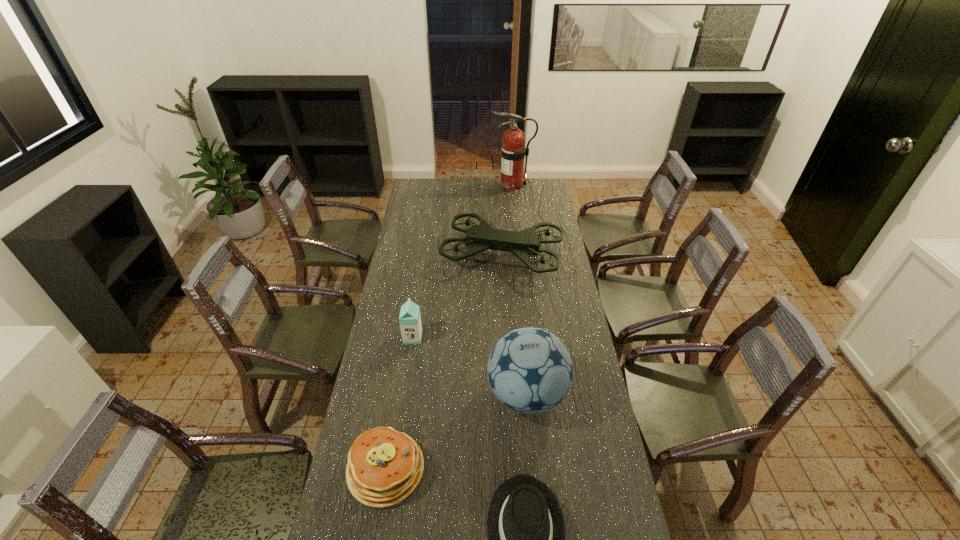
Image resolution: width=960 pixels, height=540 pixels. In order to click on drone located in the right edge section of the desktop in this screenshot , I will do `click(523, 244)`.

Where is `soccer ball situated at the right edge`? soccer ball situated at the right edge is located at coordinates (529, 370).

The image size is (960, 540). I want to click on object that is positioned at the far right corner, so click(x=513, y=151).

Find the location of a particular element. This screenshot has height=540, width=960. blank space at the left edge is located at coordinates (395, 271).

In the image, there is a desktop. Where is `vacant region at the right edge`? This screenshot has width=960, height=540. vacant region at the right edge is located at coordinates (551, 312).

Where is `blank area at the far left corner`? The image size is (960, 540). blank area at the far left corner is located at coordinates (419, 181).

Find the location of a particular element. This screenshot has width=960, height=540. vacant space at the far right corner of the desktop is located at coordinates (535, 184).

You are a GUI agent. You are given a task and a screenshot of the screen. Output one action in this format:
    pyautogui.click(x=<x>, y=<y>)
    Task: Click on the vacant space in between the third farthest object and the second farthest object
    This screenshot has width=960, height=540.
    Given the screenshot: What is the action you would take?
    pyautogui.click(x=458, y=296)

Locate an element on the screen. This screenshot has height=540, width=960. free spot between the pancake and the second farthest object is located at coordinates (444, 362).

Identify the location of vacant area between the drone and the pancake. (444, 362).